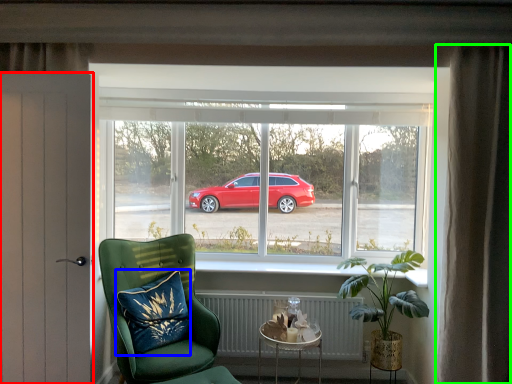
Question: Based on their relative distances, which object is nearer to door (highlighted by a red box)? Choose from pillow (highlighted by a blue box) and curtain (highlighted by a green box).

Choices:
 (A) pillow
 (B) curtain

Answer: (A)